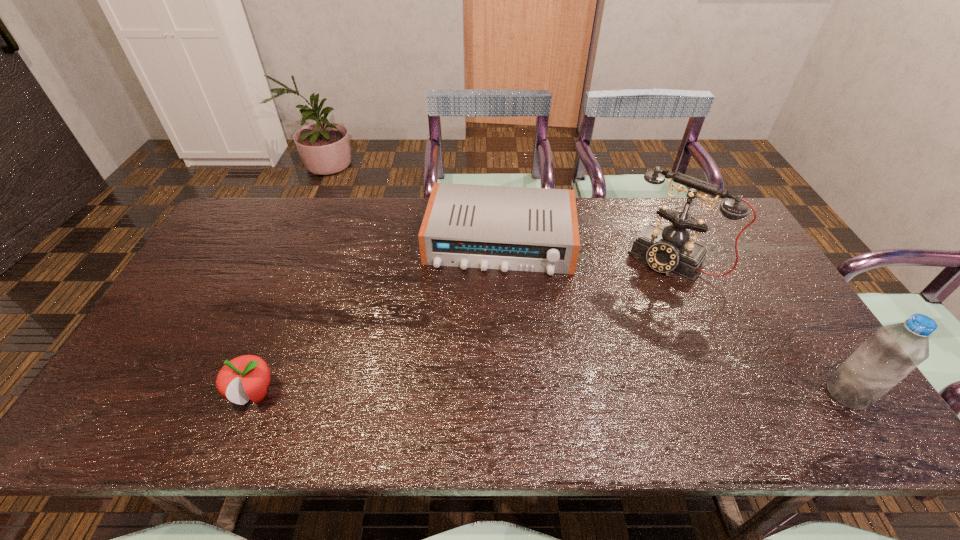
Locate an element on the screen. free location at the far edge is located at coordinates (417, 221).

Image resolution: width=960 pixels, height=540 pixels. I want to click on vacant area at the near edge of the desktop, so click(x=751, y=396).

Where is `vacant space at the left edge of the desktop`? This screenshot has height=540, width=960. vacant space at the left edge of the desktop is located at coordinates (196, 279).

The height and width of the screenshot is (540, 960). What are the coordinates of `free point at the far left corner` in the screenshot? It's located at (251, 200).

Where is `vacant position at the near right corner of the desktop`? vacant position at the near right corner of the desktop is located at coordinates (783, 366).

You are a GUI agent. You are given a task and a screenshot of the screen. Output one action in this format:
    pyautogui.click(x=<x>, y=<y>)
    Task: Click on the free area in between the rightmost object and the second object from right to left
    Image resolution: width=960 pixels, height=540 pixels.
    Given the screenshot: What is the action you would take?
    pyautogui.click(x=759, y=326)

Find the location of a particular element. empty space between the rightmost object and the third object from right to left is located at coordinates (674, 318).

Find the location of a particular element. free spot between the leftmost object and the third object from left to right is located at coordinates (463, 326).

This screenshot has height=540, width=960. What are the coordinates of `free space between the rightmost object and the second object from left to right` in the screenshot? It's located at (674, 318).

At what (x,y) coordinates should I click in order to perform the action: click on free spot between the third object from left to right and the water bottle. Please return your answer as a coordinate pair (x, y). This screenshot has width=960, height=540. Looking at the image, I should click on (759, 326).